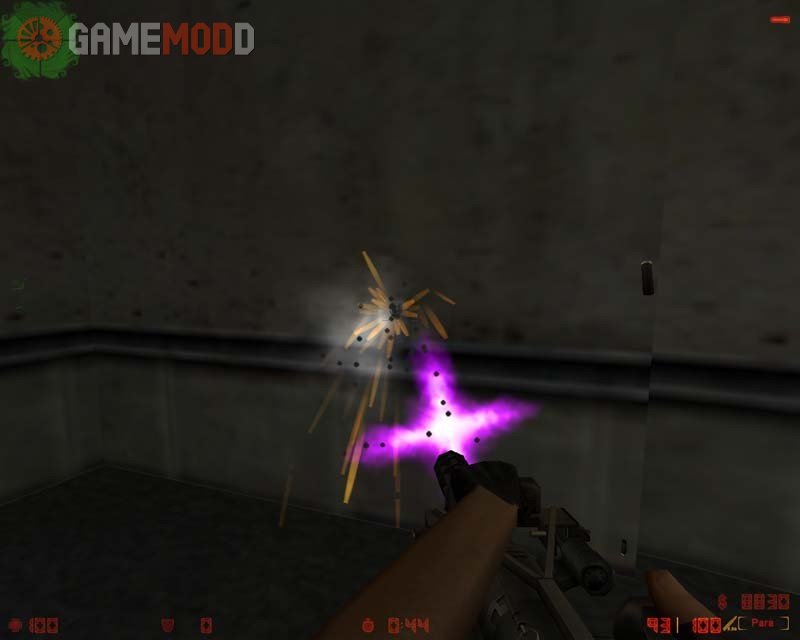
At what (x,y) coordinates should I click in order to perform the action: click on cement walls. Please return your answer as a coordinate pair (x, y). The width and height of the screenshot is (800, 640). Looking at the image, I should click on (764, 164), (534, 166), (330, 170), (206, 182), (94, 198), (42, 205).